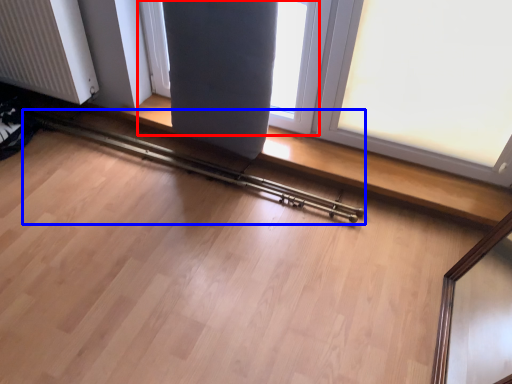
Question: Among these objects, which one is farthest to the camera, window (highlighted by a red box) or rail (highlighted by a blue box)?

Choices:
 (A) window
 (B) rail

Answer: (B)